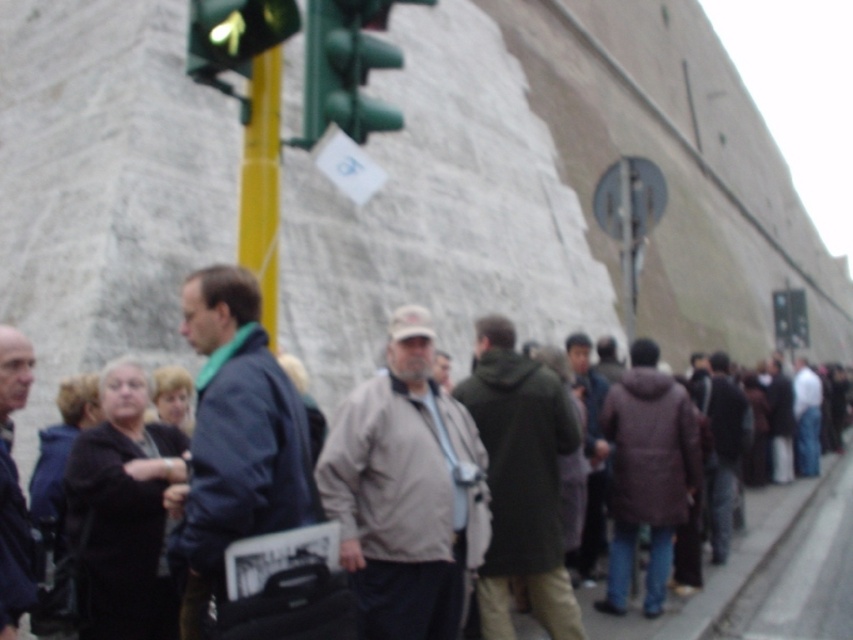
Question: Estimate the real-world distances between objects in this image. Which object is closer to the green glass traffic light at upper left?

Choices:
 (A) dark brown coat at lower left
 (B) metallic yellow pole at upper left

Answer: (B)

Question: Can you confirm if metallic yellow pole at upper left is positioned below light brown jacket at center?

Choices:
 (A) no
 (B) yes

Answer: (A)

Question: Is green matte traffic light at upper center positioned behind green glass traffic light at upper left?

Choices:
 (A) no
 (B) yes

Answer: (B)

Question: Is dark blue jacket at center wider than metallic yellow pole at upper left?

Choices:
 (A) no
 (B) yes

Answer: (A)

Question: Among these objects, which one is nearest to the camera?

Choices:
 (A) light brown jacket at center
 (B) metallic yellow pole at upper left

Answer: (A)

Question: Which point is closer to the camera?

Choices:
 (A) green matte traffic light at upper center
 (B) light brown jacket at center

Answer: (B)